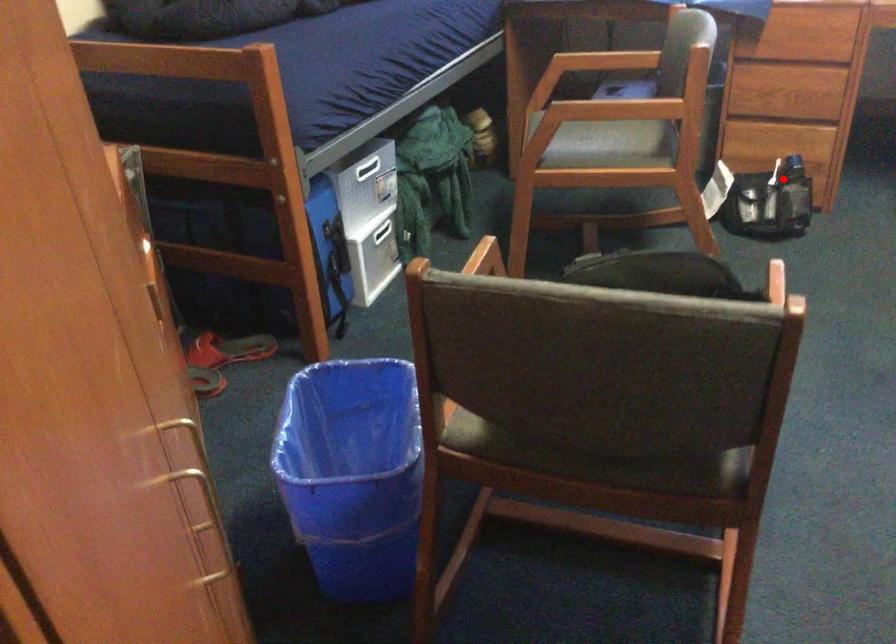
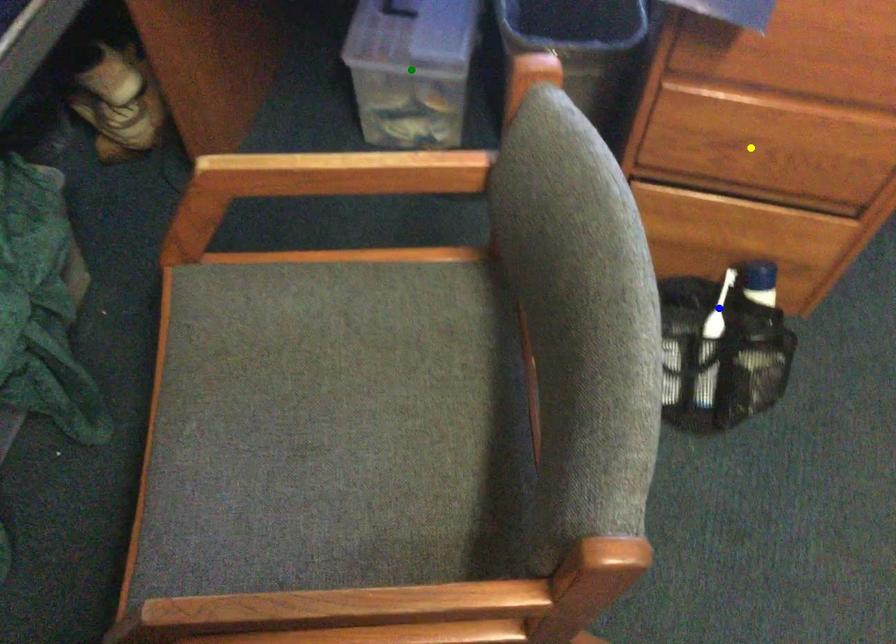
Question: I am providing you with two images of the same scene from different viewpoints. A red point is marked on the first image. You are given multiple points on the second image. Can you choose the point in image 2 that corresponds to the point in image 1?

Choices:
 (A) green point
 (B) blue point
 (C) yellow point

Answer: (B)